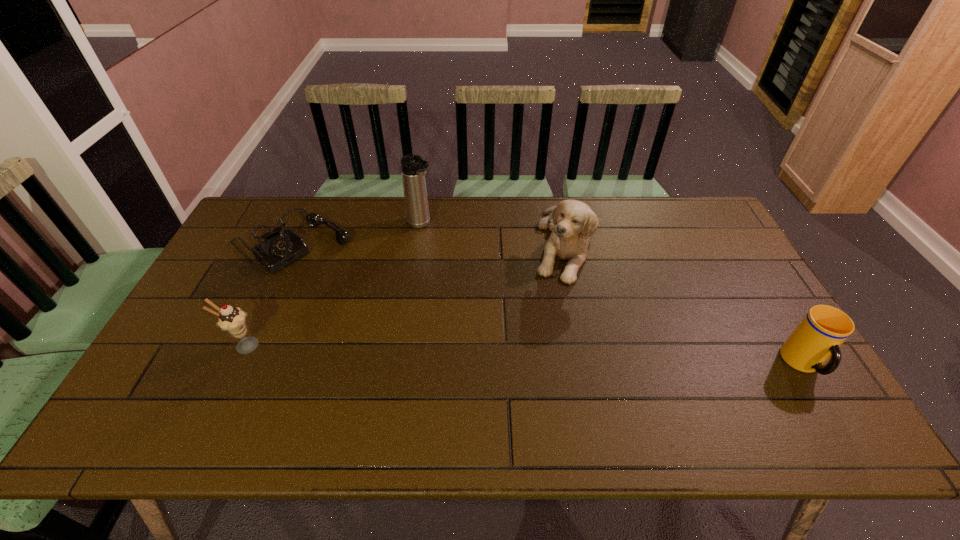
Where is `object that is at the near edge`? The width and height of the screenshot is (960, 540). object that is at the near edge is located at coordinates [x=821, y=332].

The width and height of the screenshot is (960, 540). Find the location of `icecream that is at the left edge`. icecream that is at the left edge is located at coordinates (232, 320).

The image size is (960, 540). Find the location of `telephone positioned at the left edge`. telephone positioned at the left edge is located at coordinates point(279,249).

The height and width of the screenshot is (540, 960). Identify the location of object located in the right edge section of the desktop. (821, 332).

Locate an element on the screen. Image resolution: width=960 pixels, height=540 pixels. object that is at the far left corner is located at coordinates (279, 249).

Where is `object that is at the near right corner`? The width and height of the screenshot is (960, 540). object that is at the near right corner is located at coordinates (821, 332).

In the image, there is a desktop. At what (x,y) coordinates should I click in order to perform the action: click on vacant region at the far edge. Please return your answer as a coordinate pair (x, y). Looking at the image, I should click on (300, 218).

This screenshot has width=960, height=540. Find the location of `vacant space at the near edge of the desktop`. vacant space at the near edge of the desktop is located at coordinates (646, 373).

Locate an element on the screen. Image resolution: width=960 pixels, height=540 pixels. free space at the left edge of the desktop is located at coordinates (238, 249).

At what (x,y) coordinates should I click in order to perform the action: click on vacant space at the right edge of the desktop. Please return your answer as a coordinate pair (x, y). This screenshot has width=960, height=540. Looking at the image, I should click on (701, 264).